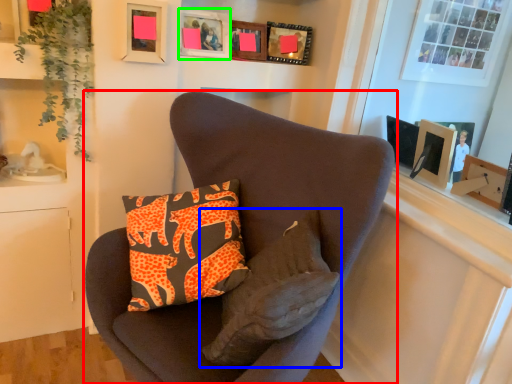
Question: Considering the real-world distances, which object is farthest from chair (highlighted by a red box)? pillow (highlighted by a blue box) or picture frame (highlighted by a green box)?

Choices:
 (A) pillow
 (B) picture frame

Answer: (B)